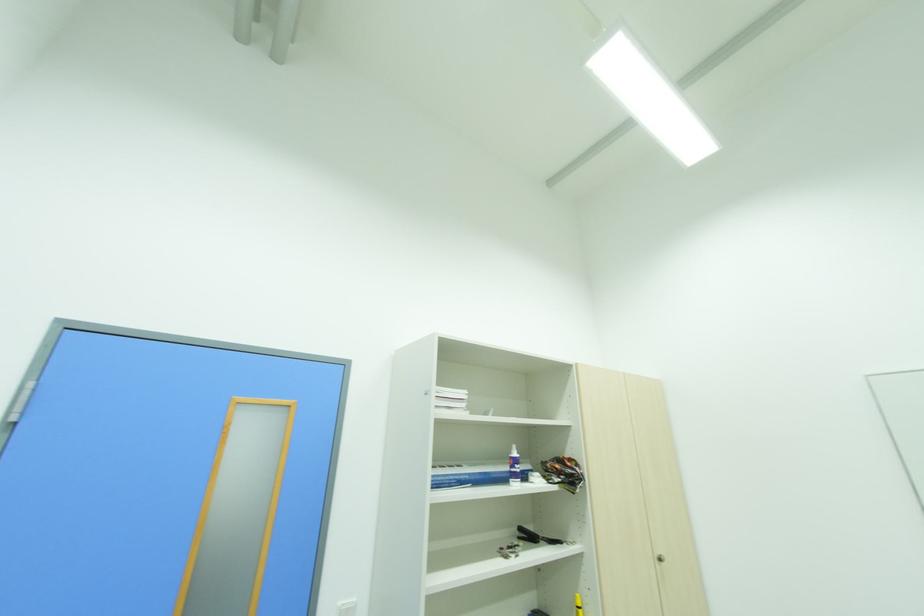
Identify the location of round cabinet handle. (660, 557).